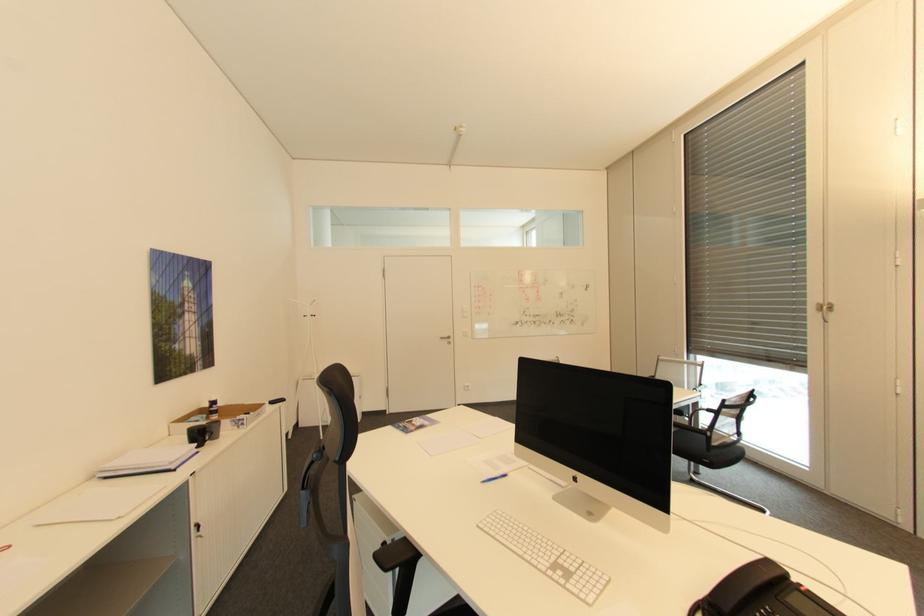
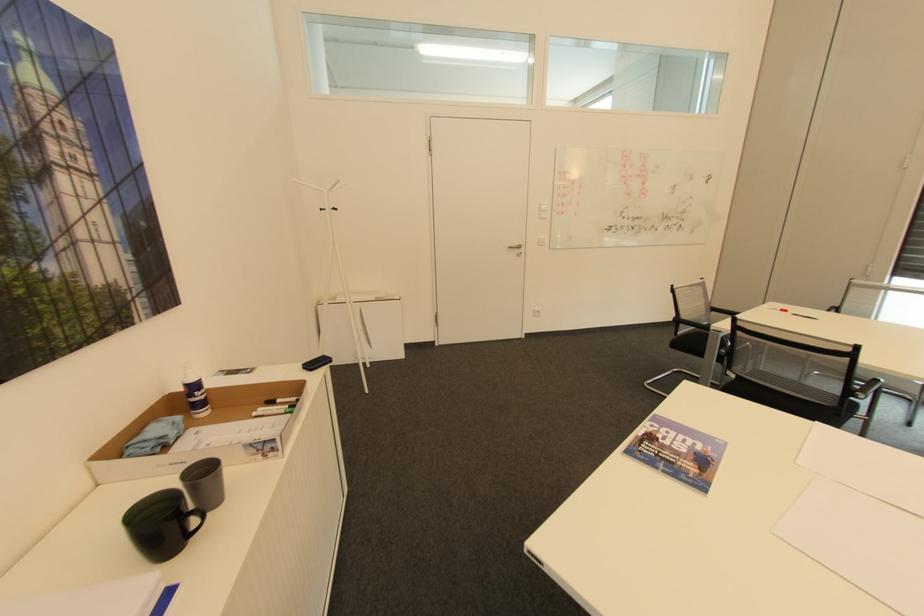
Locate, in the second image, the point that corresponds to pixel 313 315 in the first image.

(333, 208)